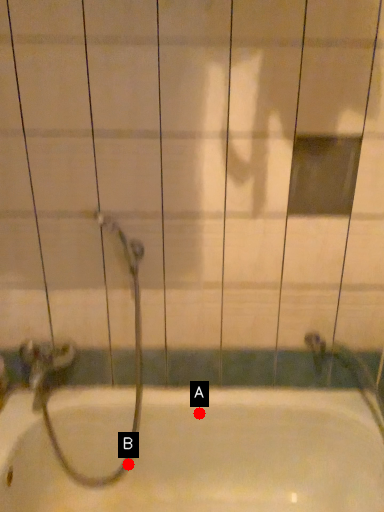
Question: Two points are circled on the image, labeled by A and B beside each circle. Which point is further to the camera?

Choices:
 (A) A is further
 (B) B is further

Answer: (B)